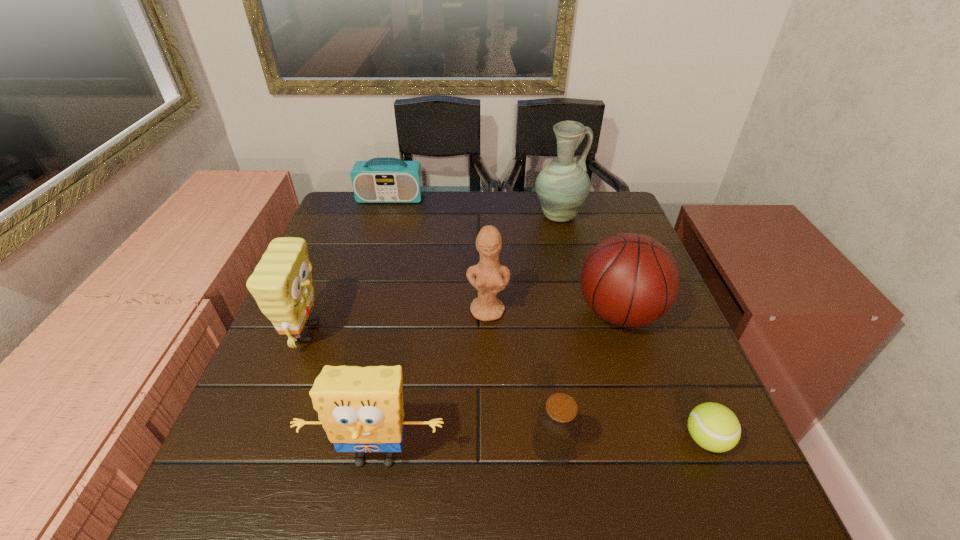
At what (x,y) coordinates should I click in order to perform the action: click on radio receiver. Please return your answer as a coordinate pair (x, y). Looking at the image, I should click on (380, 180).

What are the coordinates of `pitcher` in the screenshot? It's located at (562, 186).

Where is `figurine`? This screenshot has width=960, height=540. figurine is located at coordinates (489, 281).

Where is `the left sponge`? This screenshot has width=960, height=540. the left sponge is located at coordinates (281, 284).

Where is `basketball`? basketball is located at coordinates 628,279.

You are a GUI agent. You are given a task and a screenshot of the screen. Output one action in this format:
    pyautogui.click(x=<x>, y=<y>)
    Task: Click on the right sponge
    Image resolution: width=960 pixels, height=540 pixels.
    Given the screenshot: What is the action you would take?
    pyautogui.click(x=361, y=409)

You are a GUI agent. You are given a task and a screenshot of the screen. Output one action in this format:
    pyautogui.click(x=<x>, y=<y>)
    Task: Click on the seventh tallest object
    Image resolution: width=960 pixels, height=540 pixels.
    Given the screenshot: What is the action you would take?
    pyautogui.click(x=558, y=424)

The height and width of the screenshot is (540, 960). What are the coordinates of `the shortest object` in the screenshot? It's located at (714, 427).

The height and width of the screenshot is (540, 960). Find the location of `free space located on the front panel of the radio receiver`. free space located on the front panel of the radio receiver is located at coordinates (378, 240).

Identify the location of vacant space located 0.100m on the handle side of the pitcher. This screenshot has height=540, width=960. click(616, 217).